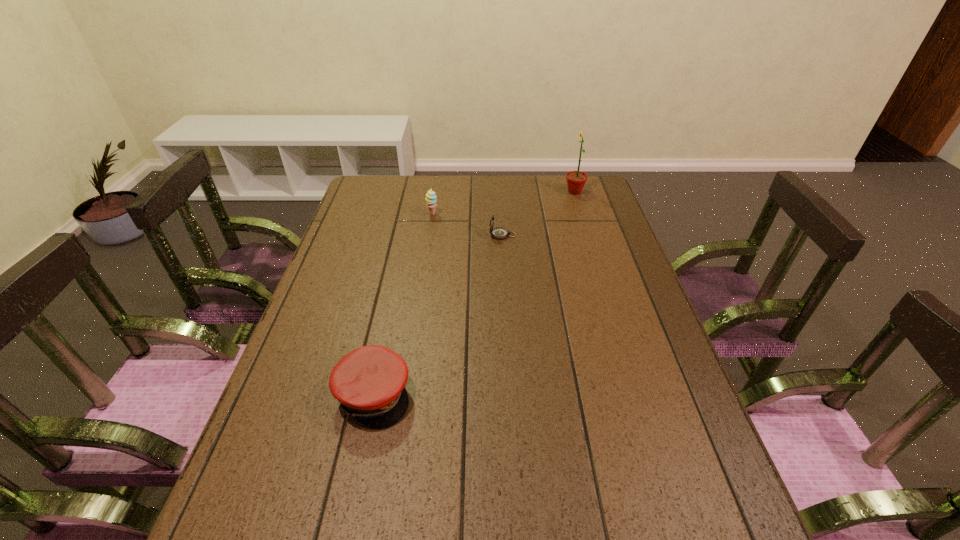
At what (x,y) coordinates should I click in order to perform the action: click on the tallest object. Please return your answer as a coordinate pair (x, y). The height and width of the screenshot is (540, 960). Looking at the image, I should click on (576, 180).

In order to click on the rightmost object in this screenshot , I will do `click(576, 180)`.

Locate an element on the screen. The image size is (960, 540). the second tallest object is located at coordinates (431, 200).

Identify the location of the third nearest object. The image size is (960, 540). (431, 200).

Find the location of a particular element. Image resolution: width=960 pixels, height=540 pixels. the second object from right to left is located at coordinates (499, 233).

Locate an element on the screen. Image resolution: width=960 pixels, height=540 pixels. the third farthest object is located at coordinates (499, 233).

Identify the location of the nearest object. Image resolution: width=960 pixels, height=540 pixels. (369, 382).

Identify the location of vacant area situated on the face of the farthest object. (487, 192).

Where is `vacant area situated on the face of the farthest object`? The width and height of the screenshot is (960, 540). vacant area situated on the face of the farthest object is located at coordinates (463, 192).

I want to click on vacant area situated on the face of the farthest object, so click(473, 192).